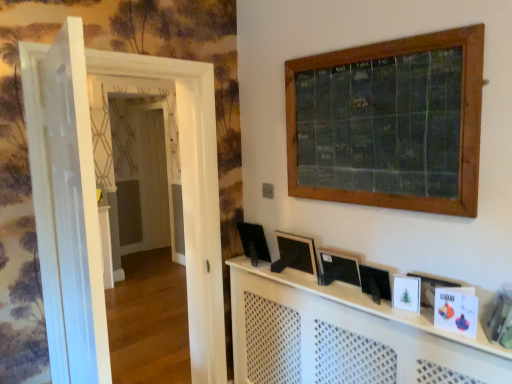
The height and width of the screenshot is (384, 512). In order to click on free space in front of black plastic computer screen at center in this screenshot , I will do `click(261, 266)`.